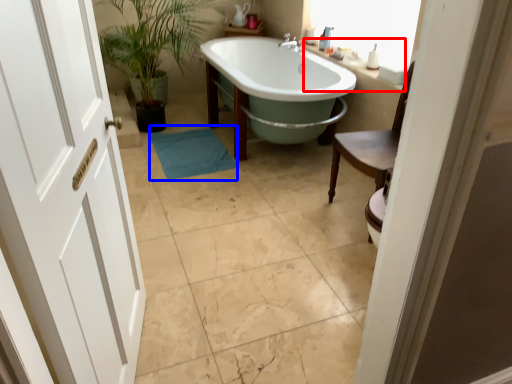
Question: Which point is further to the camera, counter top (highlighted by a red box) or bath mat (highlighted by a blue box)?

Choices:
 (A) counter top
 (B) bath mat

Answer: (B)